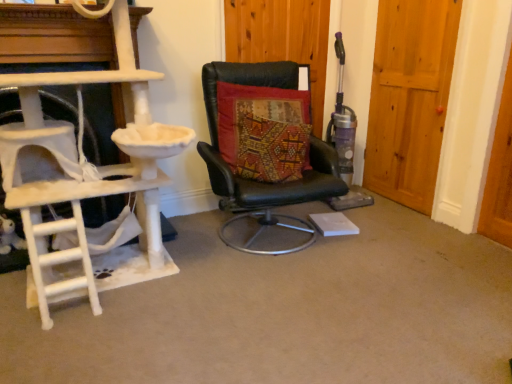
Where is `black leather chair at center`? This screenshot has height=384, width=512. black leather chair at center is located at coordinates click(264, 143).

Locate an element on the screen. This screenshot has width=512, height=384. white carpeted ladder at left is located at coordinates (85, 182).

Describe the element at coordinates (85, 182) in the screenshot. I see `white carpeted ladder at left` at that location.

I want to click on textured multicolored cushion at center, so click(x=264, y=131).

Identify the location of black leather chair at center. (264, 143).

From the image's perspective, is textured multicolored cushion at center located beneath black leather chair at center?

No, from the image's perspective, textured multicolored cushion at center is not beneath black leather chair at center.

You are a GUI agent. You are given a task and a screenshot of the screen. Output one action in this format:
    pyautogui.click(x=<x>, y=<y>)
    Task: Click on the throw pillow lying above the black leather chair at center (from the image's perspective)
    The width and height of the screenshot is (512, 384).
    Given the screenshot: What is the action you would take?
    pyautogui.click(x=264, y=131)

Does textured multicolored cushion at center have a lesser height compared to black leather chair at center?

Yes, textured multicolored cushion at center is shorter than black leather chair at center.

Between textured multicolored cushion at center and black leather chair at center, which one has larger width?

With larger width is black leather chair at center.

What's the angular difference between textured multicolored cushion at center and wooden door at center, the 1th door positioned from the left,'s facing directions?

There is a 8.96-degree angle between the facing directions of textured multicolored cushion at center and wooden door at center, the 1th door positioned from the left.

Which point is more forward, (283, 111) or (287, 49)?

The point (283, 111) is closer to the camera.

Is textured multicolored cushion at center completely or partially outside of wooden door at center, the 1th door positioned from the left?

textured multicolored cushion at center is positioned outside wooden door at center, the 1th door positioned from the left.

Is textured multicolored cushion at center not near wooden door at center, the 1th door positioned from the left?

No, textured multicolored cushion at center is not far from wooden door at center, the 1th door positioned from the left.

Considering the positions of point (302, 144) and point (87, 263), is point (302, 144) closer or farther from the camera than point (87, 263)?

Point (302, 144) is farther from the camera than point (87, 263).

Considering the relative sizes of textured multicolored cushion at center and white carpeted ladder at left in the image provided, is textured multicolored cushion at center shorter than white carpeted ladder at left?

Correct, textured multicolored cushion at center is not as tall as white carpeted ladder at left.

How far apart are textured multicolored cushion at center and white carpeted ladder at left?

textured multicolored cushion at center is 27.47 inches from white carpeted ladder at left.

Locate an element on the screen. The image size is (512, 384). throw pillow lying on the right of white carpeted ladder at left is located at coordinates (264, 131).

Is wooden door at center, the 1th door positioned from the left, in front of or behind textured multicolored cushion at center in the image?

Visually, wooden door at center, the 1th door positioned from the left, is located behind textured multicolored cushion at center.

From the image's perspective, is wooden door at center, the 1th door positioned from the left, positioned above or below textured multicolored cushion at center?

wooden door at center, the 1th door positioned from the left, is above textured multicolored cushion at center.

Can you confirm if wooden door at center, the 1th door positioned from the left, is smaller than textured multicolored cushion at center?

Yes.

Is white carpeted ladder at left placed right next to black leather chair at center?

No, white carpeted ladder at left is not making contact with black leather chair at center.

From the image's perspective, between white carpeted ladder at left and black leather chair at center, which one is located above?

black leather chair at center.

Consider the image. Is black leather chair at center inside white carpeted ladder at left?

No, white carpeted ladder at left does not contain black leather chair at center.

Is white carpeted ladder at left positioned before black leather chair at center?

That is True.

Is wooden door at center, the 2th door positioned from the right, not within wooden door at right, which appears as the 1th door when viewed from the right?

That's correct, wooden door at center, the 2th door positioned from the right, is outside of wooden door at right, which appears as the 1th door when viewed from the right.

Which is in front, point (298, 60) or point (401, 37)?

The point (401, 37) is in front.

From the image's perspective, is wooden door at center, the 1th door positioned from the left, positioned above or below wooden door at right, which appears as the 1th door when viewed from the right?

From the image's perspective, wooden door at center, the 1th door positioned from the left, appears above wooden door at right, which appears as the 1th door when viewed from the right.

How much distance is there between wooden door at center, the 2th door positioned from the right, and wooden door at right, which appears as the 1th door when viewed from the right?

They are 65.39 centimeters apart.

Considering the positions of objects wooden door at right, arranged as the 2th door when viewed from the left, and white carpeted ladder at left in the image provided, who is more to the right, wooden door at right, arranged as the 2th door when viewed from the left, or white carpeted ladder at left?

From the viewer's perspective, wooden door at right, arranged as the 2th door when viewed from the left, appears more on the right side.

Looking at this image, which of these two, wooden door at right, arranged as the 2th door when viewed from the left, or white carpeted ladder at left, stands shorter?

Standing shorter between the two is white carpeted ladder at left.

From the image's perspective, would you say wooden door at right, which appears as the 1th door when viewed from the right, is positioned over white carpeted ladder at left?

Yes, from the image's perspective, wooden door at right, which appears as the 1th door when viewed from the right, is above white carpeted ladder at left.

Considering the relative positions of wooden door at right, which appears as the 1th door when viewed from the right, and white carpeted ladder at left in the image provided, is wooden door at right, which appears as the 1th door when viewed from the right, in front of white carpeted ladder at left?

No, it is behind white carpeted ladder at left.

Where is `chair that appears below the textured multicolored cushion at center (from a real-world perspective)`? The width and height of the screenshot is (512, 384). chair that appears below the textured multicolored cushion at center (from a real-world perspective) is located at coordinates (264, 143).

Locate an element on the screen. This screenshot has width=512, height=384. throw pillow in front of the wooden door at center, the 1th door positioned from the left is located at coordinates (264, 131).

Based on the photo, considering their positions, is textured multicolored cushion at center positioned closer to white carpeted ladder at left than black leather chair at center?

black leather chair at center.

Based on their spatial positions, is wooden door at center, the 2th door positioned from the right, or black leather chair at center further from textured multicolored cushion at center?

wooden door at center, the 2th door positioned from the right.

Looking at the image, which one is located further to black leather chair at center, wooden door at right, arranged as the 2th door when viewed from the left, or wooden door at center, the 2th door positioned from the right?

wooden door at right, arranged as the 2th door when viewed from the left, lies further to black leather chair at center than the other object.

Which object lies nearer to the anchor point black leather chair at center, wooden door at center, the 2th door positioned from the right, or white carpeted ladder at left?

wooden door at center, the 2th door positioned from the right, lies closer to black leather chair at center than the other object.

Looking at the image, which one is located further to black leather chair at center, wooden door at right, which appears as the 1th door when viewed from the right, or textured multicolored cushion at center?

wooden door at right, which appears as the 1th door when viewed from the right.

Looking at the image, which one is located further to wooden door at right, arranged as the 2th door when viewed from the left, black leather chair at center or wooden door at center, the 2th door positioned from the right?

black leather chair at center.

Looking at the image, which one is located closer to wooden door at center, the 1th door positioned from the left, wooden door at right, arranged as the 2th door when viewed from the left, or black leather chair at center?

black leather chair at center is closer to wooden door at center, the 1th door positioned from the left.

From the image, which object appears to be farther from wooden door at right, arranged as the 2th door when viewed from the left, wooden door at center, the 2th door positioned from the right, or textured multicolored cushion at center?

textured multicolored cushion at center is positioned further to the anchor wooden door at right, arranged as the 2th door when viewed from the left.

I want to click on throw pillow between white carpeted ladder at left and wooden door at center, the 2th door positioned from the right, along the z-axis, so click(264, 131).

The image size is (512, 384). What are the coordinates of `chair between textured multicolored cushion at center and wooden door at right, which appears as the 1th door when viewed from the right, in the horizontal direction` in the screenshot? It's located at (264, 143).

Identify the location of throw pillow between white carpeted ladder at left and wooden door at right, which appears as the 1th door when viewed from the right. Image resolution: width=512 pixels, height=384 pixels. coord(264,131).

Identify the location of chair located between white carpeted ladder at left and wooden door at right, arranged as the 2th door when viewed from the left, in the left-right direction. [x=264, y=143].